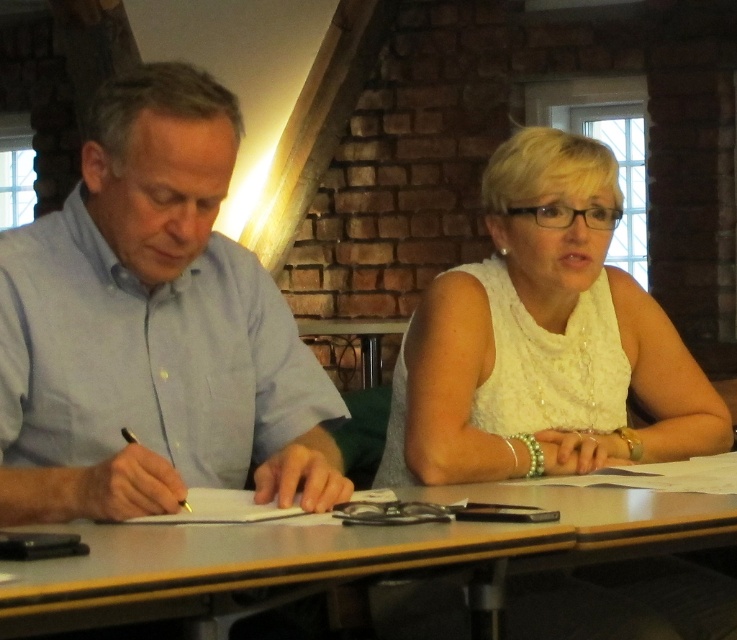
You are standing in front of the image and want to locate the light blue shirt at left. What are the coordinates of its position?

The light blue shirt at left is located at coordinates point [153,328].

You are a delivery person who needs to place a 12 inch long package on the smooth wooden table at center without it hanging over the edge. Can you safely place the package between the light blue shirt at left and the edge of the table closest to them?

The distance between the light blue shirt at left and the smooth wooden table at center is 14.70 inches. Since the package is only 12 inches long, it can fit within that space without overhanging the edge.

You are a photographer planning to take a photo of the scene. The white lace dress at center and the smooth wooden table at center are both in the frame. Which object will appear bigger in your photo?

The white lace dress at center will appear bigger in the photo because it has a larger size compared to the smooth wooden table at center.